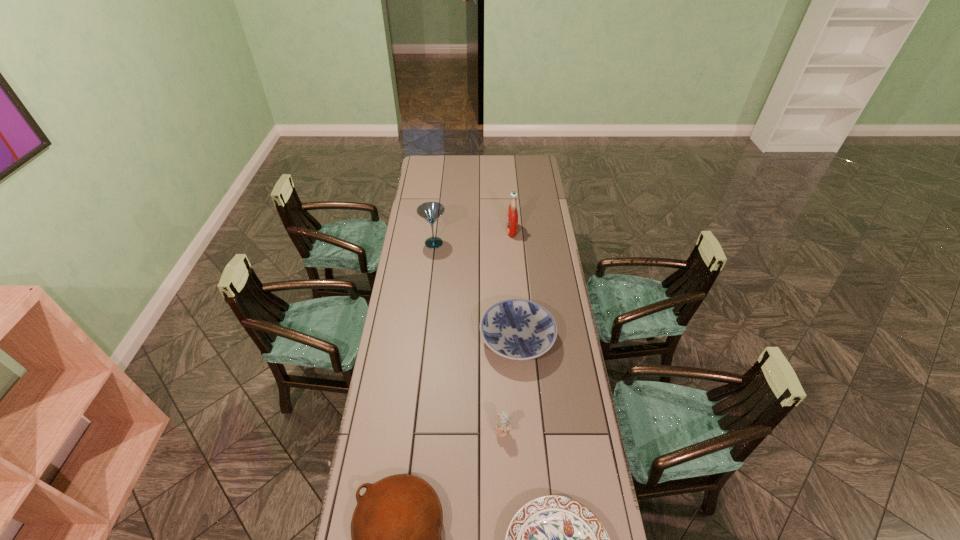
The image size is (960, 540). What are the coordinates of `detergent` in the screenshot? It's located at (512, 214).

Locate an element on the screen. Image resolution: width=960 pixels, height=540 pixels. martini is located at coordinates (430, 211).

You are a GUI agent. You are given a task and a screenshot of the screen. Output one action in this format:
    pyautogui.click(x=<x>, y=<y>)
    Task: Click on the third tallest object
    
    Given the screenshot: What is the action you would take?
    pyautogui.click(x=502, y=426)

Find the location of `the fourth farthest object`. the fourth farthest object is located at coordinates (502, 426).

The image size is (960, 540). In order to click on the tallest plate in this screenshot , I will do (517, 329).

At what (x,y) coordinates should I click in order to perform the action: click on the fourth tallest object. Please return your answer as a coordinate pair (x, y). The image size is (960, 540). Looking at the image, I should click on (517, 329).

This screenshot has height=540, width=960. In order to click on free space located on the front surface of the detergent in this screenshot , I will do point(496,230).

You are a GUI agent. You are given a task and a screenshot of the screen. Output one action in this format:
    pyautogui.click(x=<x>, y=<y>)
    Task: Click on the free space located 0.140m on the front surface of the detergent
    The image size is (960, 540).
    Given the screenshot: What is the action you would take?
    pyautogui.click(x=479, y=230)

This screenshot has width=960, height=540. What are the coordinates of `vacant space located on the front surface of the detergent` in the screenshot? It's located at 466,230.

Find the location of a particular element. This screenshot has width=960, height=540. free space located on the right of the martini is located at coordinates (501, 243).